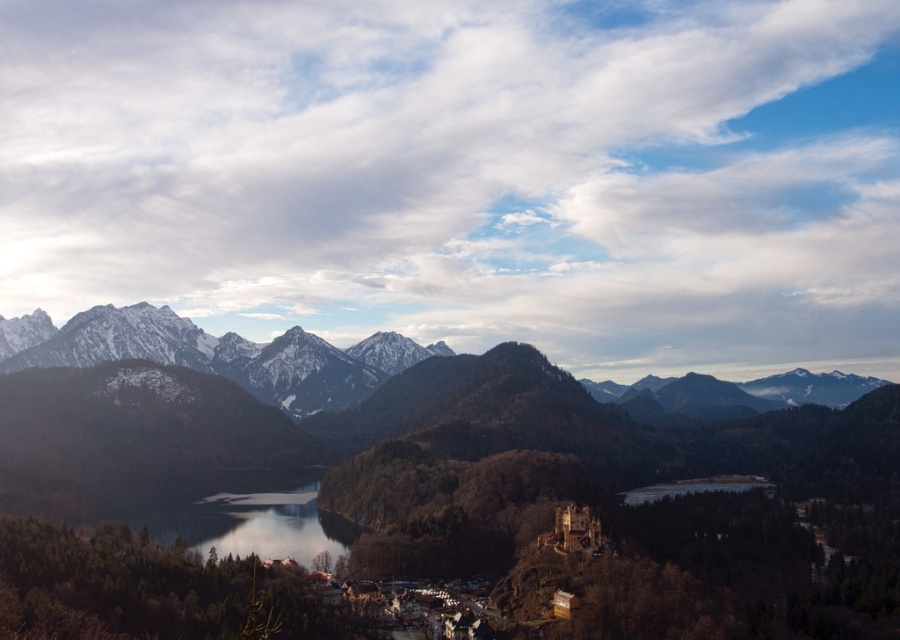
Question: Which object is farther from the camera taking this photo?

Choices:
 (A) transparent glass lake at center
 (B) snowy rocky mountains at upper left

Answer: (B)

Question: Which of the following is the farthest from the observer?

Choices:
 (A) transparent glass lake at center
 (B) snowy rocky mountains at upper left

Answer: (B)

Question: Does snowy rocky mountains at upper left appear under transparent glass lake at center?

Choices:
 (A) no
 (B) yes

Answer: (A)

Question: Is snowy rocky mountains at upper left positioned behind transparent glass lake at center?

Choices:
 (A) no
 (B) yes

Answer: (B)

Question: Which of the following is the farthest from the observer?

Choices:
 (A) (594, 397)
 (B) (199, 531)

Answer: (A)

Question: Does snowy rocky mountains at upper left have a greater width compared to transparent glass lake at center?

Choices:
 (A) no
 (B) yes

Answer: (B)